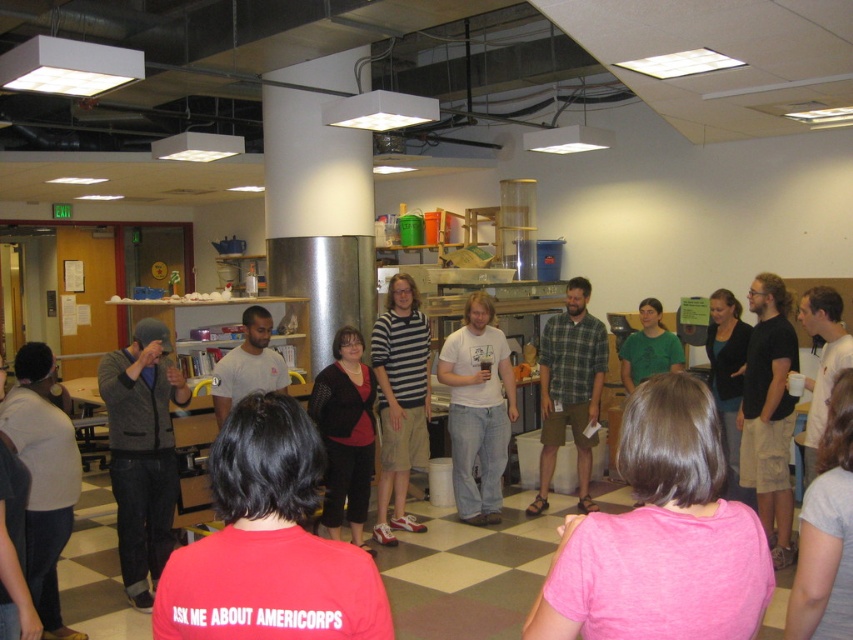
Does red matte shirt at center have a lesser height compared to dark gray knit hat at left?

Correct, red matte shirt at center is not as tall as dark gray knit hat at left.

This screenshot has height=640, width=853. Identify the location of red matte shirt at center. (268, 544).

Which of these two, red matte shirt at center or green plaid shirt at center, stands taller?

green plaid shirt at center is taller.

Which is more to the right, red matte shirt at center or green plaid shirt at center?

green plaid shirt at center

Is point (252, 448) farther from viewer compared to point (550, 332)?

No, (252, 448) is closer to viewer.

Image resolution: width=853 pixels, height=640 pixels. What are the coordinates of `red matte shirt at center` in the screenshot? It's located at (268, 544).

Is light brown cotton shirt at center in front of green plaid shirt at center?

Yes, it is in front of green plaid shirt at center.

Which is more to the right, light brown cotton shirt at center or green plaid shirt at center?

From the viewer's perspective, light brown cotton shirt at center appears more on the right side.

Identify the location of light brown cotton shirt at center. pyautogui.click(x=769, y=412).